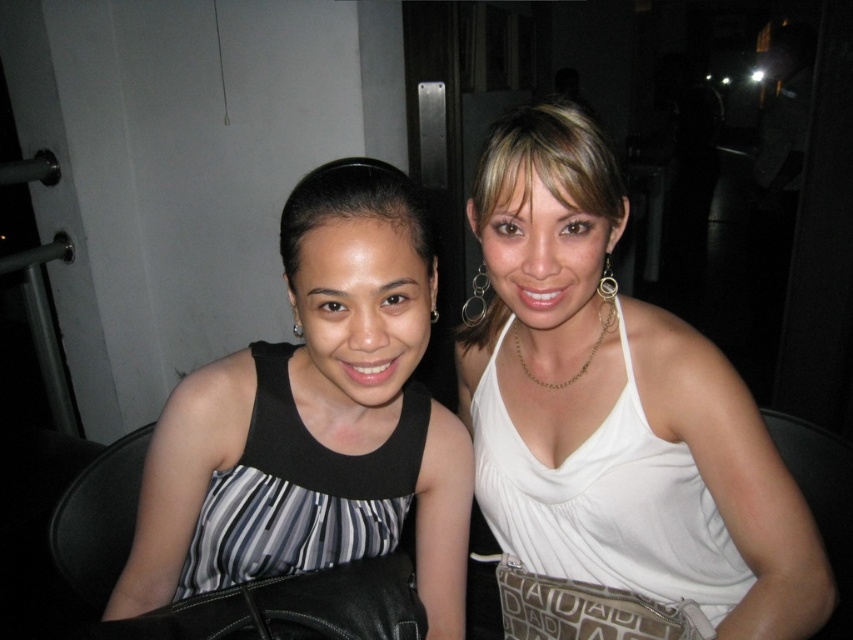
Is smooth black hair at center to the left of gold metallic hoop at upper center from the viewer's perspective?

Indeed, smooth black hair at center is positioned on the left side of gold metallic hoop at upper center.

Can you confirm if smooth black hair at center is shorter than gold metallic hoop at upper center?

No, smooth black hair at center is not shorter than gold metallic hoop at upper center.

What do you see at coordinates (352, 205) in the screenshot? I see `smooth black hair at center` at bounding box center [352, 205].

At what (x,y) coordinates should I click in order to perform the action: click on smooth black hair at center. Please return your answer as a coordinate pair (x, y). This screenshot has height=640, width=853. Looking at the image, I should click on (352, 205).

In the scene shown: Is black striped dress at center further to camera compared to silver metallic earring at upper left?

No, it is not.

Between black striped dress at center and silver metallic earring at upper left, which one appears on the left side from the viewer's perspective?

silver metallic earring at upper left is more to the left.

I want to click on black striped dress at center, so click(x=315, y=420).

The height and width of the screenshot is (640, 853). I want to click on black striped dress at center, so click(315, 420).

Describe the element at coordinates (315, 420) in the screenshot. The width and height of the screenshot is (853, 640). I see `black striped dress at center` at that location.

The width and height of the screenshot is (853, 640). What do you see at coordinates (315, 420) in the screenshot? I see `black striped dress at center` at bounding box center [315, 420].

Where is `black striped dress at center`? This screenshot has width=853, height=640. black striped dress at center is located at coordinates (315, 420).